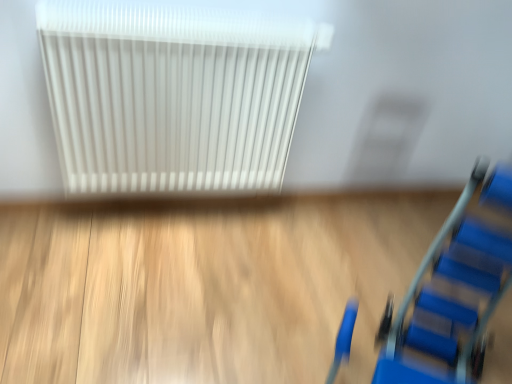
Question: From a real-world perspective, relative to white plastic radiator at upper center, is blue plastic ladder at lower right vertically above or below?

Choices:
 (A) below
 (B) above

Answer: (A)

Question: Considering the positions of point (398, 377) and point (175, 8), is point (398, 377) closer or farther from the camera than point (175, 8)?

Choices:
 (A) farther
 (B) closer

Answer: (A)

Question: Which is correct: blue plastic ladder at lower right is inside white plastic radiator at upper center, or outside of it?

Choices:
 (A) outside
 (B) inside

Answer: (A)

Question: Considering the positions of point (154, 48) and point (480, 367), is point (154, 48) closer or farther from the camera than point (480, 367)?

Choices:
 (A) closer
 (B) farther

Answer: (A)

Question: From a real-world perspective, is white plastic radiator at upper center physically located above or below blue plastic ladder at lower right?

Choices:
 (A) below
 (B) above

Answer: (B)

Question: Would you say white plastic radiator at upper center is to the left or to the right of blue plastic ladder at lower right in the picture?

Choices:
 (A) left
 (B) right

Answer: (A)

Question: Which is correct: white plastic radiator at upper center is inside blue plastic ladder at lower right, or outside of it?

Choices:
 (A) outside
 (B) inside

Answer: (A)